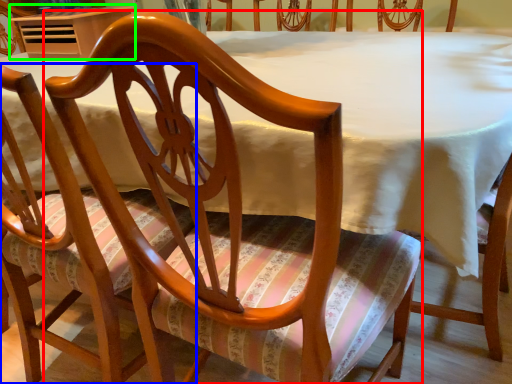
Question: Based on their relative distances, which object is nearer to chair (highlighted by a red box)? Choose from chair (highlighted by a blue box) and table (highlighted by a green box).

Choices:
 (A) chair
 (B) table

Answer: (A)